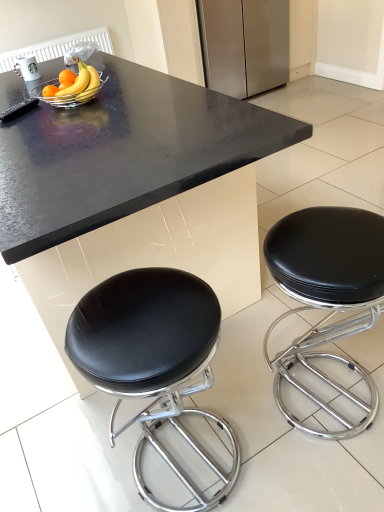
Question: Can you confirm if black granite table at center is shorter than metallic silver bowl at upper center?

Choices:
 (A) no
 (B) yes

Answer: (A)

Question: Is black granite table at center oriented away from metallic silver bowl at upper center?

Choices:
 (A) yes
 (B) no

Answer: (B)

Question: Is black granite table at center positioned far away from metallic silver bowl at upper center?

Choices:
 (A) no
 (B) yes

Answer: (A)

Question: From a real-world perspective, is black granite table at center under metallic silver bowl at upper center?

Choices:
 (A) no
 (B) yes

Answer: (B)

Question: Considering the relative positions of black granite table at center and metallic silver bowl at upper center in the image provided, is black granite table at center to the left of metallic silver bowl at upper center from the viewer's perspective?

Choices:
 (A) yes
 (B) no

Answer: (B)

Question: From a real-world perspective, relative to metallic silver bowl at upper center, is black granite table at center vertically above or below?

Choices:
 (A) above
 (B) below

Answer: (B)

Question: Considering the positions of black granite table at center and metallic silver bowl at upper center in the image, is black granite table at center taller or shorter than metallic silver bowl at upper center?

Choices:
 (A) tall
 (B) short

Answer: (A)

Question: Choose the correct answer: Is black granite table at center inside metallic silver bowl at upper center or outside it?

Choices:
 (A) inside
 (B) outside

Answer: (B)

Question: Looking at their shapes, would you say black granite table at center is wider or thinner than metallic silver bowl at upper center?

Choices:
 (A) thin
 (B) wide

Answer: (B)

Question: Is black leather stool at lower right, the 2th stool positioned from the right, taller or shorter than black granite table at center?

Choices:
 (A) short
 (B) tall

Answer: (A)

Question: Looking at their shapes, would you say black leather stool at lower right, the 2th stool positioned from the right, is wider or thinner than black granite table at center?

Choices:
 (A) wide
 (B) thin

Answer: (B)

Question: Is black leather stool at lower right, the 2th stool positioned from the right, situated inside black granite table at center or outside?

Choices:
 (A) outside
 (B) inside

Answer: (A)

Question: In the image, is black leather stool at lower right, the 2th stool positioned from the right, on the left side or the right side of black granite table at center?

Choices:
 (A) right
 (B) left

Answer: (A)

Question: Is black leather stool at lower right, the 2th stool positioned from the right, situated inside stainless steel refrigerator at upper center or outside?

Choices:
 (A) inside
 (B) outside

Answer: (B)

Question: Is black leather stool at lower right, the 2th stool positioned from the right, wider or thinner than stainless steel refrigerator at upper center?

Choices:
 (A) thin
 (B) wide

Answer: (A)